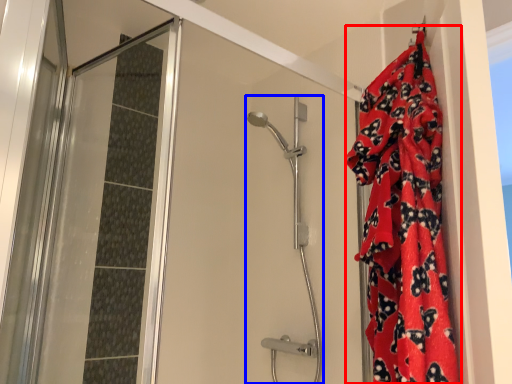
Question: Among these objects, which one is farthest to the camera, blanket (highlighted by a red box) or shower door (highlighted by a blue box)?

Choices:
 (A) blanket
 (B) shower door

Answer: (B)